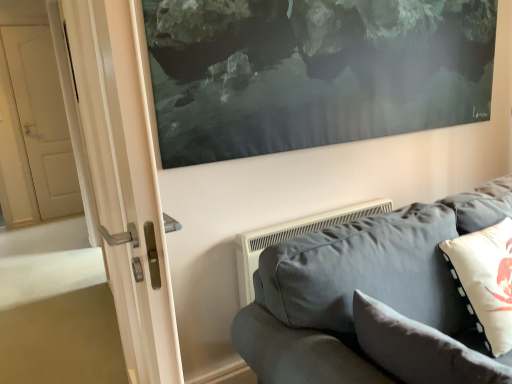
Question: Is white matte pillow at right, placed as the first pillow when sorted from right to left, completely or partially outside of velvet gray couch at lower right?

Choices:
 (A) no
 (B) yes

Answer: (A)

Question: Is white matte pillow at right, the second pillow from the left, to the left of velvet gray couch at lower right from the viewer's perspective?

Choices:
 (A) no
 (B) yes

Answer: (A)

Question: From a real-world perspective, is white matte pillow at right, placed as the first pillow when sorted from right to left, over velvet gray couch at lower right?

Choices:
 (A) yes
 (B) no

Answer: (A)

Question: From the image's perspective, is white matte pillow at right, the second pillow from the left, located beneath velvet gray couch at lower right?

Choices:
 (A) no
 (B) yes

Answer: (A)

Question: Is white matte pillow at right, the second pillow from the left, touching velvet gray couch at lower right?

Choices:
 (A) yes
 (B) no

Answer: (B)

Question: Is white matte pillow at right, placed as the first pillow when sorted from right to left, shorter than velvet gray couch at lower right?

Choices:
 (A) yes
 (B) no

Answer: (A)

Question: Is velvet gray couch at lower right positioned before soft gray cushion at lower right, which is the first pillow from left to right?

Choices:
 (A) no
 (B) yes

Answer: (B)

Question: Can you confirm if velvet gray couch at lower right is wider than soft gray cushion at lower right, which is counted as the 2th pillow, starting from the right?

Choices:
 (A) no
 (B) yes

Answer: (B)

Question: Can you confirm if velvet gray couch at lower right is taller than soft gray cushion at lower right, which is counted as the 2th pillow, starting from the right?

Choices:
 (A) no
 (B) yes

Answer: (B)

Question: Considering the relative positions of velvet gray couch at lower right and soft gray cushion at lower right, which is the first pillow from left to right, in the image provided, is velvet gray couch at lower right to the left of soft gray cushion at lower right, which is the first pillow from left to right, from the viewer's perspective?

Choices:
 (A) yes
 (B) no

Answer: (B)

Question: Is velvet gray couch at lower right turned away from soft gray cushion at lower right, which is counted as the 2th pillow, starting from the right?

Choices:
 (A) no
 (B) yes

Answer: (B)

Question: Would you say velvet gray couch at lower right is outside soft gray cushion at lower right, which is the first pillow from left to right?

Choices:
 (A) yes
 (B) no

Answer: (A)

Question: Can you confirm if soft gray cushion at lower right, which is the first pillow from left to right, is wider than velvet gray couch at lower right?

Choices:
 (A) no
 (B) yes

Answer: (A)